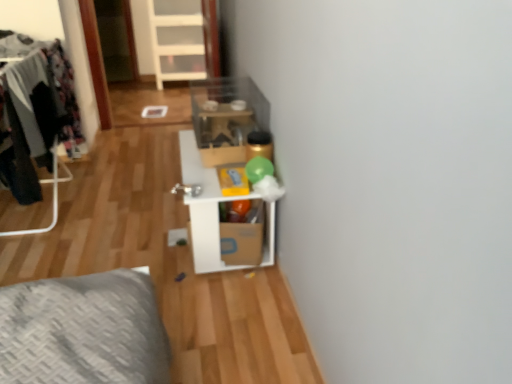
Locate an element on the screen. The image size is (512, 384). free location in front of white cardboard shelf at center is located at coordinates (222, 314).